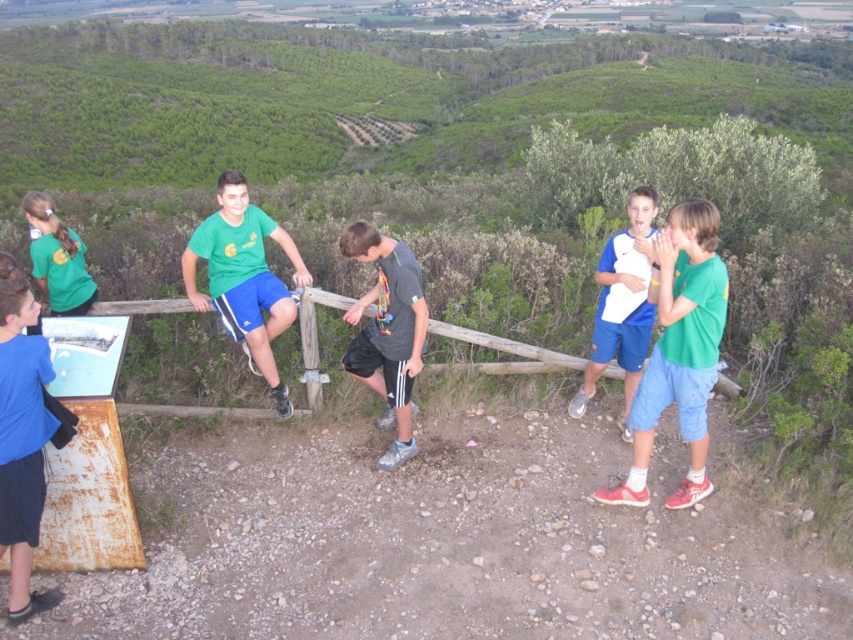
Question: Considering the real-world distances, which object is closest to the dark gray fabric shorts at center?

Choices:
 (A) blue fabric shirt at right
 (B) green matte shirt at right

Answer: (A)

Question: Does dark gray fabric shorts at center appear over blue fabric shirt at right?

Choices:
 (A) yes
 (B) no

Answer: (B)

Question: Based on their relative distances, which object is nearer to the green matte shirt at right?

Choices:
 (A) green matte t-shirt at center
 (B) blue fabric shirt at right

Answer: (B)

Question: In this image, where is green matte t-shirt at center located relative to dark gray fabric shorts at center?

Choices:
 (A) right
 (B) left

Answer: (B)

Question: Is the position of green matte shirt at right less distant than that of blue fabric shirt at right?

Choices:
 (A) no
 (B) yes

Answer: (B)

Question: Which of the following is the farthest from the observer?

Choices:
 (A) blue fabric shirt at right
 (B) green matte shirt at right
 (C) dark gray fabric shorts at center
 (D) green matte t-shirt at center

Answer: (D)